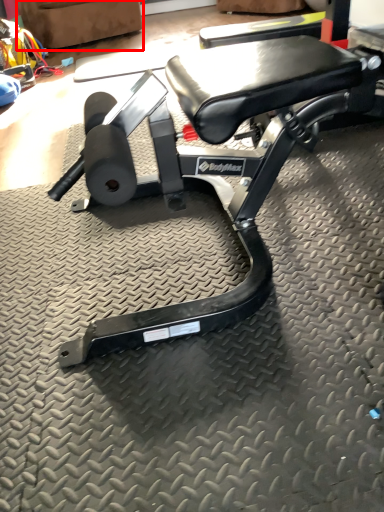
Question: In this image, where is swivel chair (annotated by the red box) located relative to bench?

Choices:
 (A) left
 (B) right

Answer: (A)